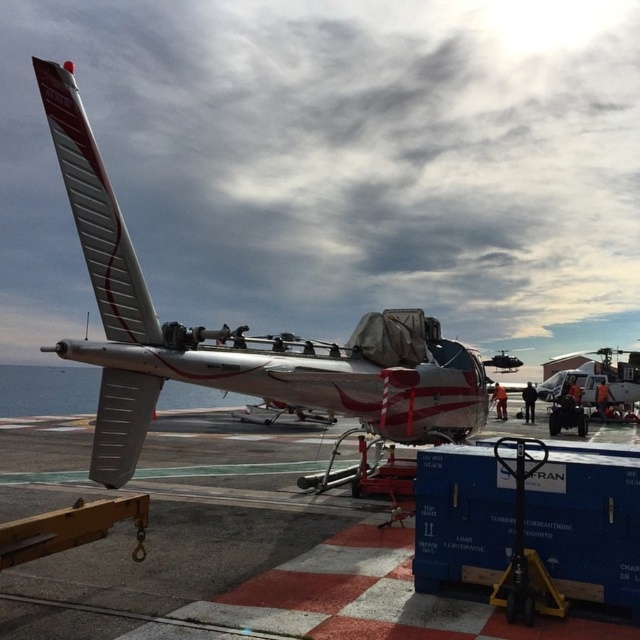
You are a maintenance worker standing on the smooth concrete tarmac at center and need to reach the silver metallic airplane at center. Which direction should you move to get closer to the airplane?

Since the smooth concrete tarmac at center is closer to the viewer than the silver metallic airplane at center, you should move forward towards the airplane to get closer.

You are a maintenance worker at the heliport. You need to place a new equipment box on the smooth concrete tarmac at center. The equipment box is 1.2 meters tall. Will the silver metallic airplane at center block the sunlight from reaching the box if placed there?

The smooth concrete tarmac at center has a lesser height compared to silver metallic airplane at center. Since the airplane is taller, it may cast a shadow over the tarmac, potentially blocking sunlight from reaching the equipment box placed there.

You are a technician standing at the point labeled as point [214,376]. You need to reach point [381,548] to inspect a part of the helicopter. Is the path clear between these two points?

Point [381,548] is in front of point [214,376], so the path is clear between these two points.